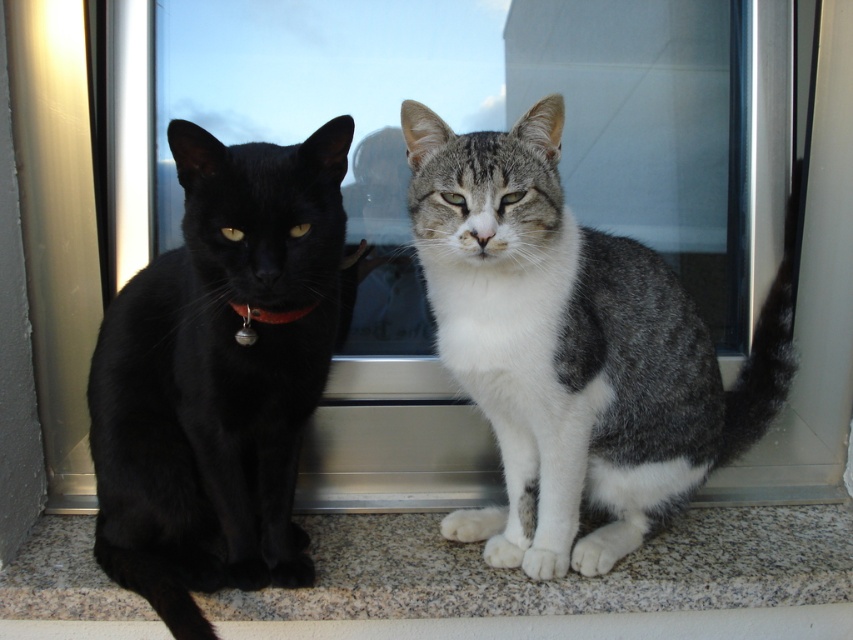
Question: Which is nearer to the red leather collar at center?

Choices:
 (A) granite at lower center
 (B) gray-white fur cat at center
 (C) matte black cat at left

Answer: (C)

Question: Is the position of gray-white fur cat at center more distant than that of red leather collar at center?

Choices:
 (A) yes
 (B) no

Answer: (A)

Question: Does gray-white fur cat at center have a lesser width compared to matte black cat at left?

Choices:
 (A) yes
 (B) no

Answer: (B)

Question: Among these points, which one is farthest from the camera?

Choices:
 (A) (264, 316)
 (B) (225, 308)

Answer: (B)

Question: Which object appears closest to the camera in this image?

Choices:
 (A) granite at lower center
 (B) red leather collar at center
 (C) gray-white fur cat at center

Answer: (B)

Question: Does gray-white fur cat at center appear under red leather collar at center?

Choices:
 (A) yes
 (B) no

Answer: (A)